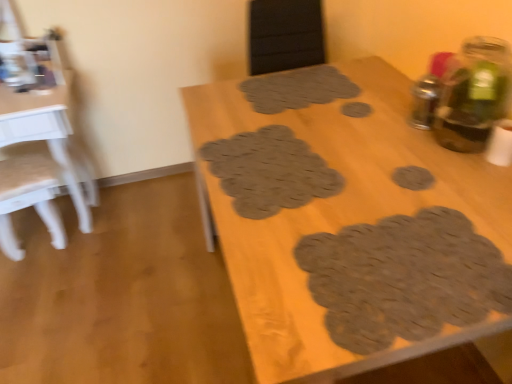
I want to click on free space that is in between brown textured mat at center, which is the first footprint in top-to-bottom order, and brown textured coaster at center-right, the third footprint positioned from the front, so click(365, 140).